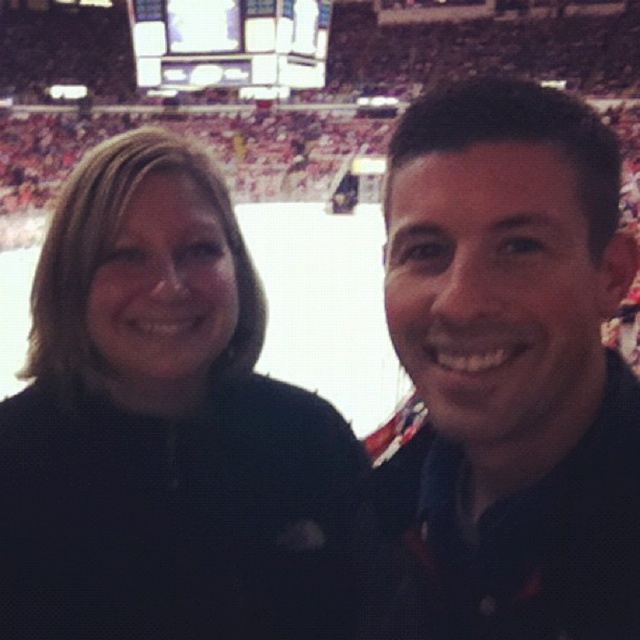
How much distance is there between black fleece jacket at left and matte black shirt at right?

black fleece jacket at left is 10.35 meters away from matte black shirt at right.

Which of these two, black fleece jacket at left or matte black shirt at right, stands shorter?

black fleece jacket at left is shorter.

Is point (205, 202) farther from camera compared to point (461, 429)?

Yes, it is behind point (461, 429).

You are a GUI agent. You are given a task and a screenshot of the screen. Output one action in this format:
    pyautogui.click(x=<x>, y=<y>)
    Task: Click on the black fleece jacket at left
    
    Given the screenshot: What is the action you would take?
    pyautogui.click(x=164, y=428)